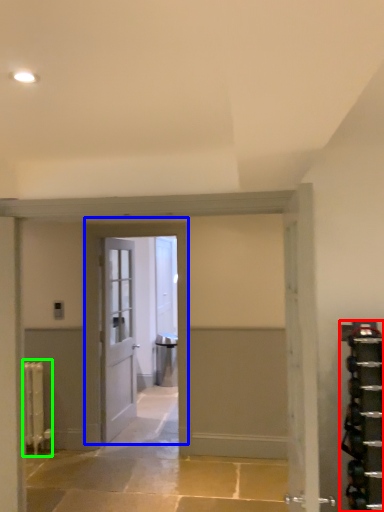
Question: Based on their relative distances, which object is nearer to shelf (highlighted by a red box)? Choose from door (highlighted by a blue box) and radiator (highlighted by a green box).

Choices:
 (A) door
 (B) radiator

Answer: (A)